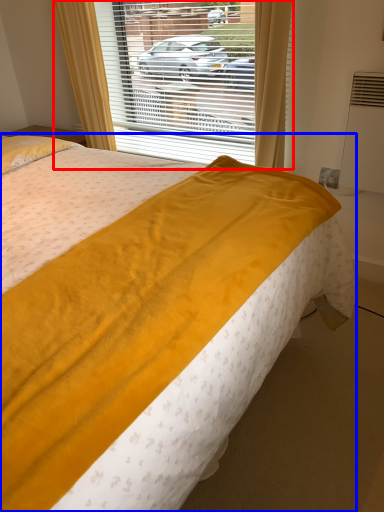
Question: Which of the following is the farthest to the observer, window (highlighted by a red box) or bed (highlighted by a blue box)?

Choices:
 (A) window
 (B) bed

Answer: (A)